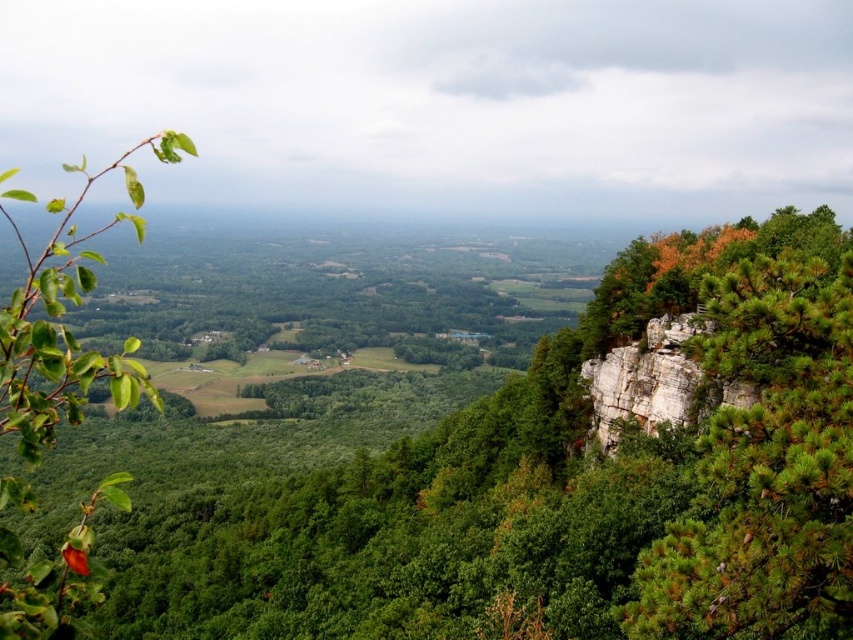
Is point (798, 577) closer to camera compared to point (132, 387)?

No, it is behind (132, 387).

Where is `green pine tree at right`? The image size is (853, 640). green pine tree at right is located at coordinates (764, 467).

Consider the image. Which is more to the left, green matte tree at upper left or green pine tree at right?

Positioned to the left is green matte tree at upper left.

Locate an element on the screen. The image size is (853, 640). green matte tree at upper left is located at coordinates (567, 483).

Is green matte tree at upper left further to camera compared to green matte leaf at left?

Yes.

Is the position of green matte tree at upper left less distant than that of green matte leaf at left?

No, green matte tree at upper left is behind green matte leaf at left.

Who is more forward, [659,515] or [25,314]?

Point [25,314] is in front.

I want to click on green matte tree at upper left, so click(567, 483).